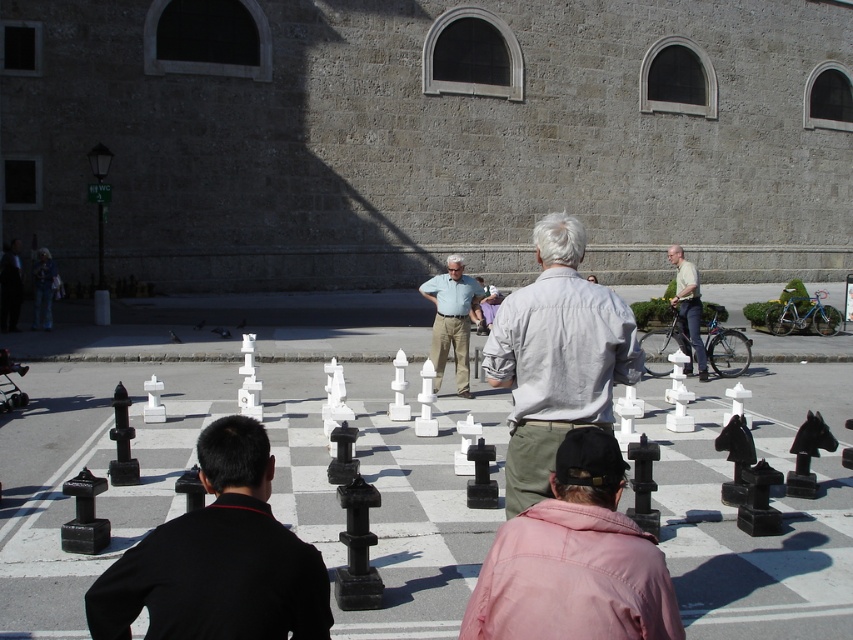
Question: Which object is the closest to the light gray shirt at center?

Choices:
 (A) matte pink shirt at center
 (B) black matte chess piece at lower left

Answer: (A)

Question: Can you confirm if black matte chess piece at lower left is smaller than matte pink shirt at center?

Choices:
 (A) yes
 (B) no

Answer: (B)

Question: Which point is farther to the camera?

Choices:
 (A) light beige shirt at center
 (B) light blue shirt at center
 (C) light gray shirt at center

Answer: (A)

Question: From the image, what is the correct spatial relationship of black matte chess piece at lower left in relation to matte pink shirt at center?

Choices:
 (A) above
 (B) below

Answer: (A)

Question: Considering the relative positions of light gray shirt at center and light blue shirt at center in the image provided, where is light gray shirt at center located with respect to light blue shirt at center?

Choices:
 (A) below
 (B) above

Answer: (B)

Question: Which point is closer to the camera taking this photo?

Choices:
 (A) (305, 547)
 (B) (680, 284)
 (C) (445, 316)
 (D) (612, 456)

Answer: (A)